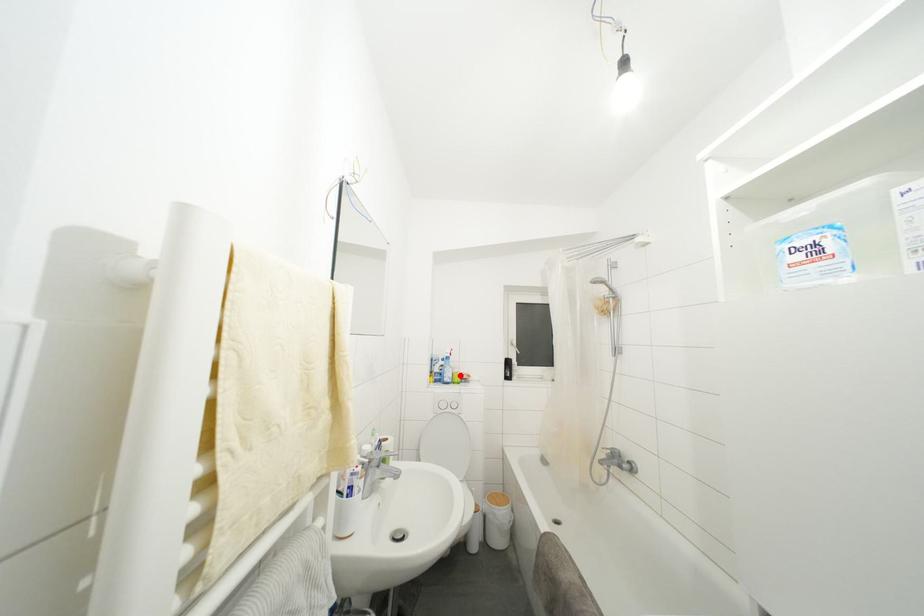
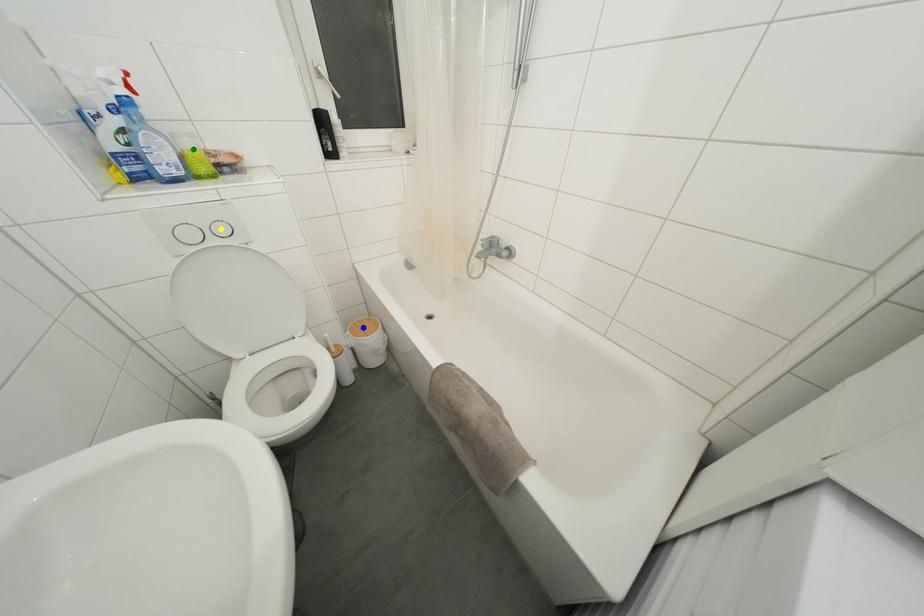
Question: I am providing you with two images of the same scene from different viewpoints. A red point is marked on the first image. You are given multiple points on the second image. Can you choose the point in image 2 that corresponds to the point in image 1?

Choices:
 (A) green point
 (B) blue point
 (C) yellow point

Answer: (A)